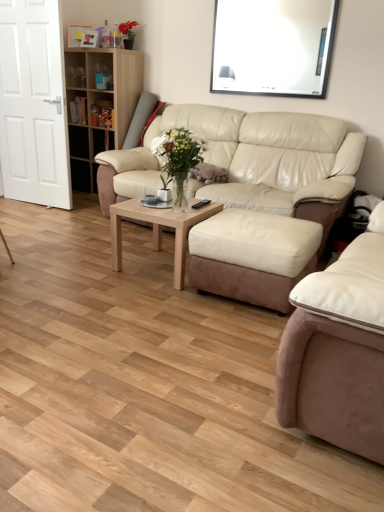
The image size is (384, 512). In order to click on free space to the left of beige leather couch at center, which is the first studio couch in front-to-back order in this screenshot , I will do `click(165, 366)`.